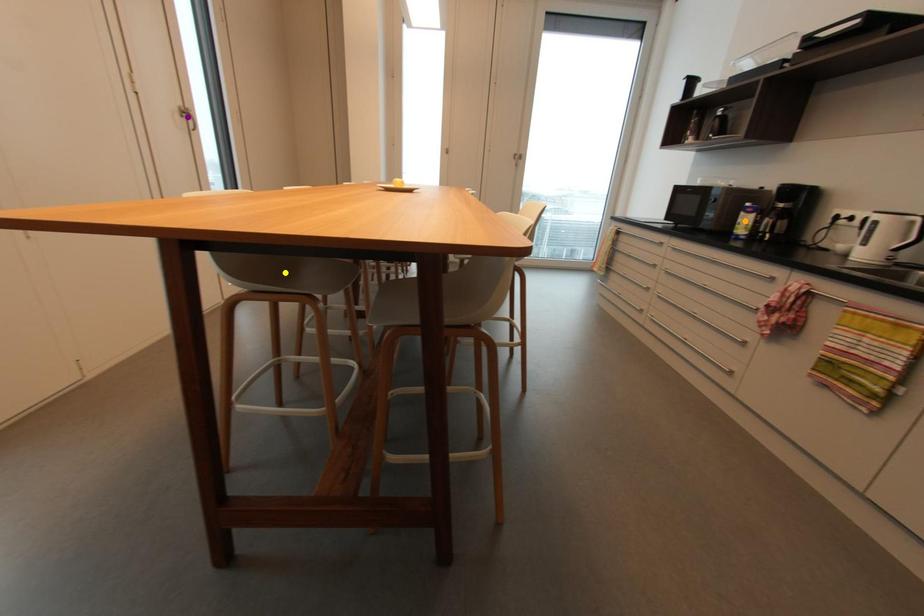
Order these from nearest to farthest:
1. yellow point
2. purple point
3. orange point

yellow point
orange point
purple point